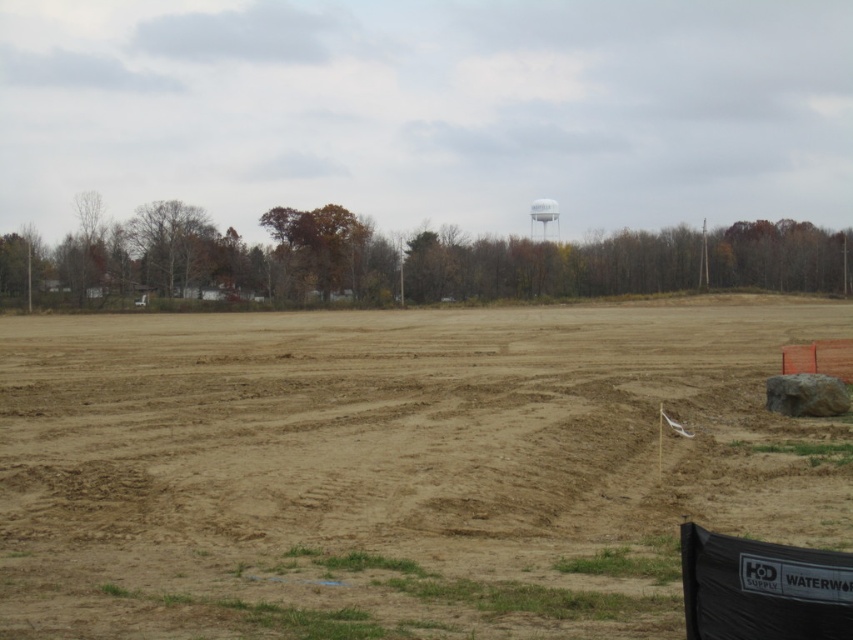
Who is positioned more to the right, brown sandy dirt field at center or white matte water tower at upper center?

white matte water tower at upper center is more to the right.

This screenshot has width=853, height=640. Describe the element at coordinates (396, 468) in the screenshot. I see `brown sandy dirt field at center` at that location.

This screenshot has height=640, width=853. In order to click on brown sandy dirt field at center in this screenshot , I will do `click(396, 468)`.